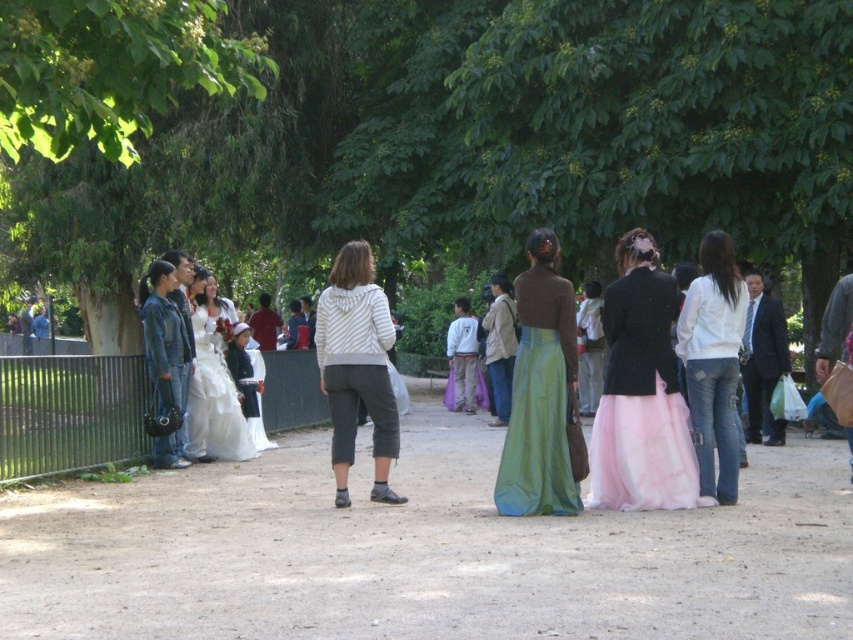
This screenshot has height=640, width=853. What do you see at coordinates (357, 368) in the screenshot?
I see `white striped sweater at center` at bounding box center [357, 368].

Between white striped sweater at center and white distressed jeans at lower right, which one appears on the right side from the viewer's perspective?

Positioned to the right is white distressed jeans at lower right.

Who is more forward, (370, 339) or (723, 499)?

Point (370, 339)

Image resolution: width=853 pixels, height=640 pixels. What are the coordinates of `white striped sweater at center` in the screenshot? It's located at (357, 368).

Which is behind, point (154, 88) or point (556, 310)?

The point (556, 310) is more distant.

This screenshot has height=640, width=853. I want to click on green leafy tree at center, so click(x=431, y=140).

Who is positioned more to the right, pink tulle skirt at center or white distressed jeans at lower right?

white distressed jeans at lower right is more to the right.

Locate an element on the screen. pink tulle skirt at center is located at coordinates (641, 392).